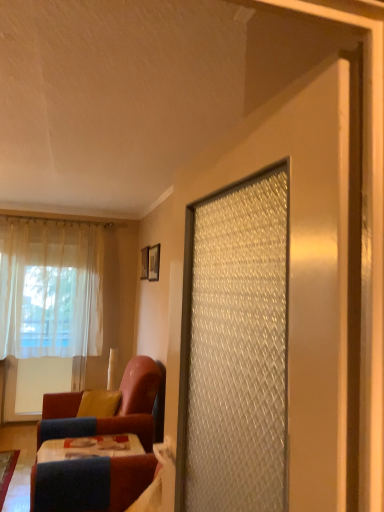
Question: Is velvet-like red chair at lower left at the right side of yellow fabric pillow at lower left?

Choices:
 (A) no
 (B) yes

Answer: (B)

Question: Could you tell me if velvet-like red chair at lower left is facing yellow fabric pillow at lower left?

Choices:
 (A) no
 (B) yes

Answer: (B)

Question: Is velvet-like red chair at lower left outside of yellow fabric pillow at lower left?

Choices:
 (A) no
 (B) yes

Answer: (B)

Question: Can you confirm if velvet-like red chair at lower left is shorter than yellow fabric pillow at lower left?

Choices:
 (A) no
 (B) yes

Answer: (A)

Question: Can you confirm if velvet-like red chair at lower left is smaller than yellow fabric pillow at lower left?

Choices:
 (A) no
 (B) yes

Answer: (A)

Question: Can you confirm if velvet-like red chair at lower left is thinner than yellow fabric pillow at lower left?

Choices:
 (A) no
 (B) yes

Answer: (A)

Question: Considering the relative sizes of white sheer curtain at left and matte black picture frame at upper center, placed as the 1th picture frame when sorted from front to back, in the image provided, is white sheer curtain at left shorter than matte black picture frame at upper center, placed as the 1th picture frame when sorted from front to back,?

Choices:
 (A) no
 (B) yes

Answer: (A)

Question: Does white sheer curtain at left have a greater height compared to matte black picture frame at upper center, placed as the 1th picture frame when sorted from front to back?

Choices:
 (A) no
 (B) yes

Answer: (B)

Question: Considering the relative positions of white sheer curtain at left and matte black picture frame at upper center, placed as the 1th picture frame when sorted from front to back, in the image provided, is white sheer curtain at left to the left of matte black picture frame at upper center, placed as the 1th picture frame when sorted from front to back, from the viewer's perspective?

Choices:
 (A) yes
 (B) no

Answer: (A)

Question: From the image's perspective, is white sheer curtain at left over matte black picture frame at upper center, placed as the 1th picture frame when sorted from front to back?

Choices:
 (A) no
 (B) yes

Answer: (A)

Question: Can you confirm if white sheer curtain at left is positioned to the right of matte black picture frame at upper center, placed as the 1th picture frame when sorted from front to back?

Choices:
 (A) yes
 (B) no

Answer: (B)

Question: Is white sheer curtain at left bigger than matte black picture frame at upper center, acting as the first picture frame starting from the right?

Choices:
 (A) no
 (B) yes

Answer: (B)

Question: Is wooden picture frame at upper center, acting as the second picture frame starting from the front, positioned before wooden table at lower left?

Choices:
 (A) yes
 (B) no

Answer: (B)